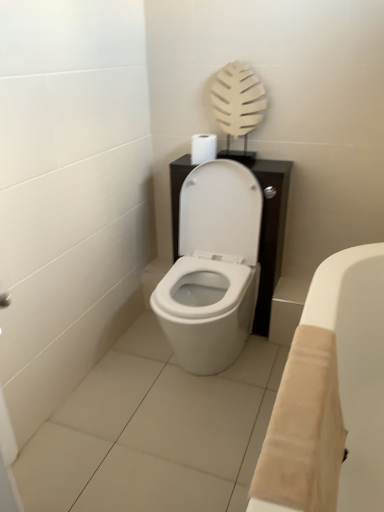
Question: Is beige fabric bath at lower right thinner than white matte toilet paper at center?

Choices:
 (A) yes
 (B) no

Answer: (B)

Question: Can you confirm if beige fabric bath at lower right is positioned to the left of white matte toilet paper at center?

Choices:
 (A) yes
 (B) no

Answer: (B)

Question: From a real-world perspective, is beige fabric bath at lower right physically above white matte toilet paper at center?

Choices:
 (A) yes
 (B) no

Answer: (B)

Question: From a real-world perspective, is beige fabric bath at lower right positioned under white matte toilet paper at center based on gravity?

Choices:
 (A) no
 (B) yes

Answer: (B)

Question: Is the depth of beige fabric bath at lower right greater than that of white matte toilet paper at center?

Choices:
 (A) no
 (B) yes

Answer: (A)

Question: From the image's perspective, is beige fabric bath at lower right under white matte toilet paper at center?

Choices:
 (A) yes
 (B) no

Answer: (A)

Question: Is the depth of white matte toilet paper at center greater than that of beige fabric bath at lower right?

Choices:
 (A) no
 (B) yes

Answer: (B)

Question: Is white matte toilet paper at center facing towards beige fabric bath at lower right?

Choices:
 (A) yes
 (B) no

Answer: (B)

Question: Would you say white matte toilet paper at center is outside beige fabric bath at lower right?

Choices:
 (A) no
 (B) yes

Answer: (B)

Question: Considering the relative sizes of white matte toilet paper at center and beige fabric bath at lower right in the image provided, is white matte toilet paper at center shorter than beige fabric bath at lower right?

Choices:
 (A) yes
 (B) no

Answer: (A)

Question: Considering the relative sizes of white matte toilet paper at center and beige fabric bath at lower right in the image provided, is white matte toilet paper at center bigger than beige fabric bath at lower right?

Choices:
 (A) no
 (B) yes

Answer: (A)

Question: Would you say beige fabric bath at lower right is part of white matte toilet paper at center's contents?

Choices:
 (A) yes
 (B) no

Answer: (B)

Question: Is white matte toilet paper at center situated inside beige fabric bath at lower right or outside?

Choices:
 (A) inside
 (B) outside

Answer: (B)